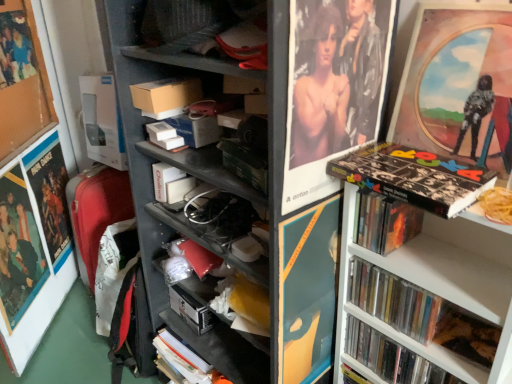
Question: From the image's perspective, is matte plastic picture frame at upper right, the first picture frame positioned from the right, located above or below wooden frame poster at upper left, placed as the 3th poster page when sorted from right to left?

Choices:
 (A) below
 (B) above

Answer: (A)

Question: Is matte plastic picture frame at upper right, the first picture frame positioned from the right, spatially inside wooden frame poster at upper left, marked as the 1th poster page in a left-to-right arrangement, or outside of it?

Choices:
 (A) inside
 (B) outside

Answer: (B)

Question: Which of these objects is positioned closest to the matte paper poster at left, the third poster page from the left?

Choices:
 (A) matte cardboard box at center
 (B) matte black poster at left, the 2th poster page when ordered from left to right
 (C) black matte book at upper right, arranged as the 3th book when viewed from the right
 (D) black matte book at lower right, arranged as the fifth book when viewed from the left
 (E) white matte book at center, the fifth book viewed from the right

Answer: (B)

Question: Considering the real-world distances, which object is closest to the wooden frame poster at upper left, marked as the 1th poster page in a left-to-right arrangement?

Choices:
 (A) matte black poster at left, the 2th poster page when ordered from left to right
 (B) matte cardboard box at center
 (C) hardcover book at upper right, acting as the 2th book starting from the left
 (D) matte paper poster at left, the third poster page from the left
 (E) matte black bookshelf at center

Answer: (A)